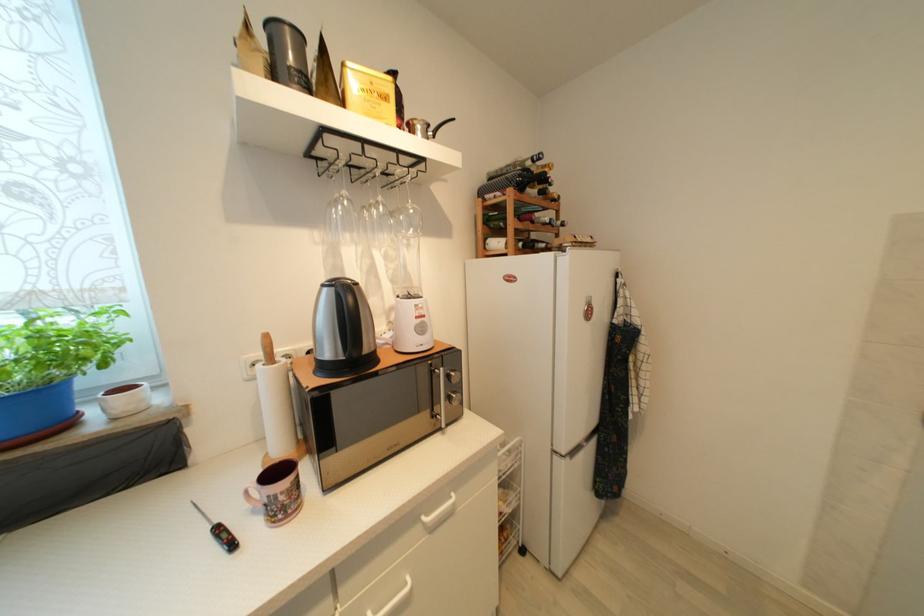
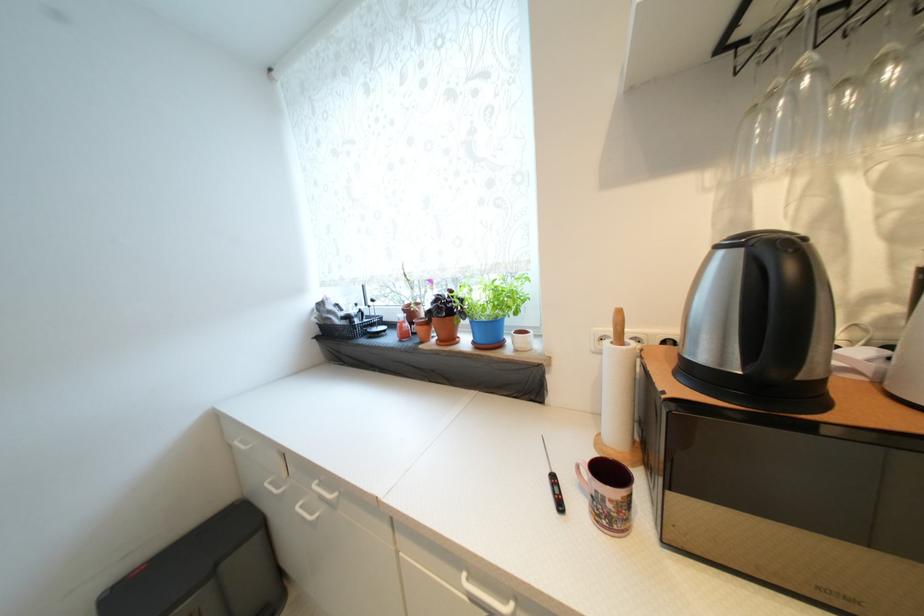
Where in the second image is the point corresponding to point 329,286 from the first image?

(723, 249)